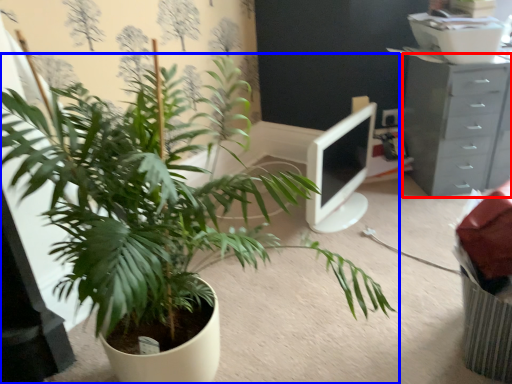
Question: Which of the following is the farthest to the observer, chest of drawers (highlighted by a red box) or houseplant (highlighted by a blue box)?

Choices:
 (A) chest of drawers
 (B) houseplant

Answer: (A)